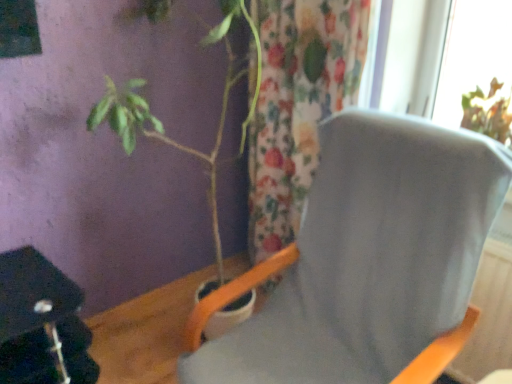
Question: Considering the relative sizes of green matte plant at left and gray fabric chair at center in the image provided, is green matte plant at left smaller than gray fabric chair at center?

Choices:
 (A) yes
 (B) no

Answer: (A)

Question: From the image's perspective, is green matte plant at left below gray fabric chair at center?

Choices:
 (A) no
 (B) yes

Answer: (A)

Question: Is there a large distance between green matte plant at left and gray fabric chair at center?

Choices:
 (A) yes
 (B) no

Answer: (B)

Question: Is green matte plant at left positioned behind gray fabric chair at center?

Choices:
 (A) yes
 (B) no

Answer: (A)

Question: Does green matte plant at left touch gray fabric chair at center?

Choices:
 (A) no
 (B) yes

Answer: (A)

Question: Visually, is green matte plant at left positioned to the left or to the right of gray fabric chair at center?

Choices:
 (A) right
 (B) left

Answer: (B)

Question: Which is correct: green matte plant at left is inside gray fabric chair at center, or outside of it?

Choices:
 (A) outside
 (B) inside

Answer: (A)

Question: Is green matte plant at left bigger or smaller than gray fabric chair at center?

Choices:
 (A) big
 (B) small

Answer: (B)

Question: Does point (129, 107) appear closer or farther from the camera than point (486, 150)?

Choices:
 (A) farther
 (B) closer

Answer: (A)

Question: Considering the positions of green matte plant at left and floral fabric curtain at center in the image, is green matte plant at left wider or thinner than floral fabric curtain at center?

Choices:
 (A) wide
 (B) thin

Answer: (A)

Question: From a real-world perspective, is green matte plant at left positioned above or below floral fabric curtain at center?

Choices:
 (A) above
 (B) below

Answer: (B)

Question: From the image's perspective, is green matte plant at left located above or below floral fabric curtain at center?

Choices:
 (A) above
 (B) below

Answer: (B)

Question: Visually, is green matte plant at left positioned to the left or to the right of floral fabric curtain at center?

Choices:
 (A) left
 (B) right

Answer: (A)

Question: From a real-world perspective, is gray fabric chair at center physically located above or below floral fabric curtain at center?

Choices:
 (A) below
 (B) above

Answer: (A)

Question: Considering the positions of gray fabric chair at center and floral fabric curtain at center in the image, is gray fabric chair at center taller or shorter than floral fabric curtain at center?

Choices:
 (A) tall
 (B) short

Answer: (B)